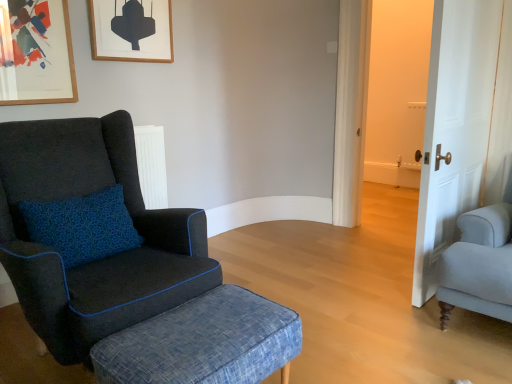
Question: Does white wood door at right appear on the left side of denim textured stool at lower left?

Choices:
 (A) no
 (B) yes

Answer: (A)

Question: From the image's perspective, is white wood door at right on top of denim textured stool at lower left?

Choices:
 (A) no
 (B) yes

Answer: (B)

Question: Is white wood door at right facing away from denim textured stool at lower left?

Choices:
 (A) no
 (B) yes

Answer: (A)

Question: Considering the relative sizes of white wood door at right and denim textured stool at lower left in the image provided, is white wood door at right taller than denim textured stool at lower left?

Choices:
 (A) yes
 (B) no

Answer: (A)

Question: Does white wood door at right have a smaller size compared to denim textured stool at lower left?

Choices:
 (A) no
 (B) yes

Answer: (A)

Question: Can you see white wood door at right touching denim textured stool at lower left?

Choices:
 (A) yes
 (B) no

Answer: (B)

Question: From a real-world perspective, is velvet dark blue armchair at left over wooden picture frame at upper center, marked as the 1th picture frame in a back-to-front arrangement?

Choices:
 (A) yes
 (B) no

Answer: (B)

Question: Is velvet dark blue armchair at left shorter than wooden picture frame at upper center, which ranks as the 2th picture frame in front-to-back order?

Choices:
 (A) no
 (B) yes

Answer: (A)

Question: Is velvet dark blue armchair at left further to camera compared to wooden picture frame at upper center, which is counted as the first picture frame, starting from the right?

Choices:
 (A) yes
 (B) no

Answer: (B)

Question: From the image's perspective, is velvet dark blue armchair at left located beneath wooden picture frame at upper center, which is counted as the first picture frame, starting from the right?

Choices:
 (A) no
 (B) yes

Answer: (B)

Question: Are velvet dark blue armchair at left and wooden picture frame at upper center, marked as the 1th picture frame in a back-to-front arrangement, making contact?

Choices:
 (A) yes
 (B) no

Answer: (B)

Question: Is velvet dark blue armchair at left positioned before wooden picture frame at upper center, positioned as the 2th picture frame in left-to-right order?

Choices:
 (A) yes
 (B) no

Answer: (A)

Question: From the image's perspective, is white wood door at right above wooden picture frame at upper left, the 2th picture frame in the right-to-left sequence?

Choices:
 (A) no
 (B) yes

Answer: (A)